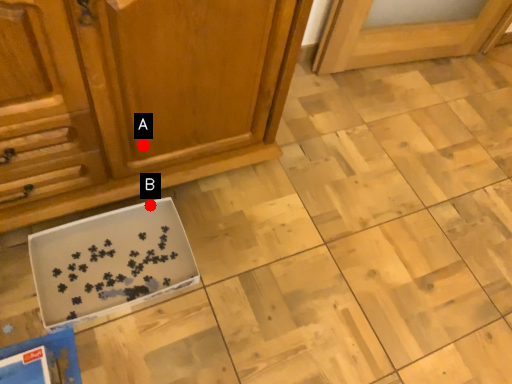
Question: Two points are circled on the image, labeled by A and B beside each circle. Among these points, which one is farthest from the camera?

Choices:
 (A) A is further
 (B) B is further

Answer: (B)